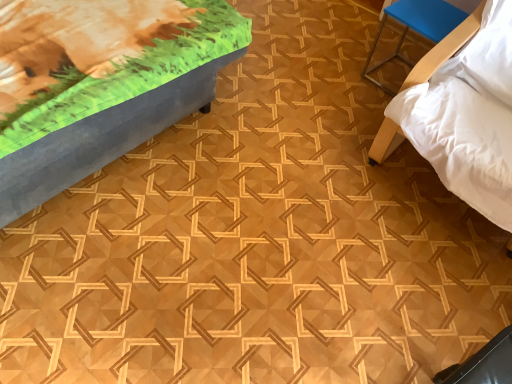
I want to click on vacant area that lies between white soft bed at right, the 3th furniture from the left, and matte gray bench at upper left, acting as the 1th furniture starting from the left, so click(271, 166).